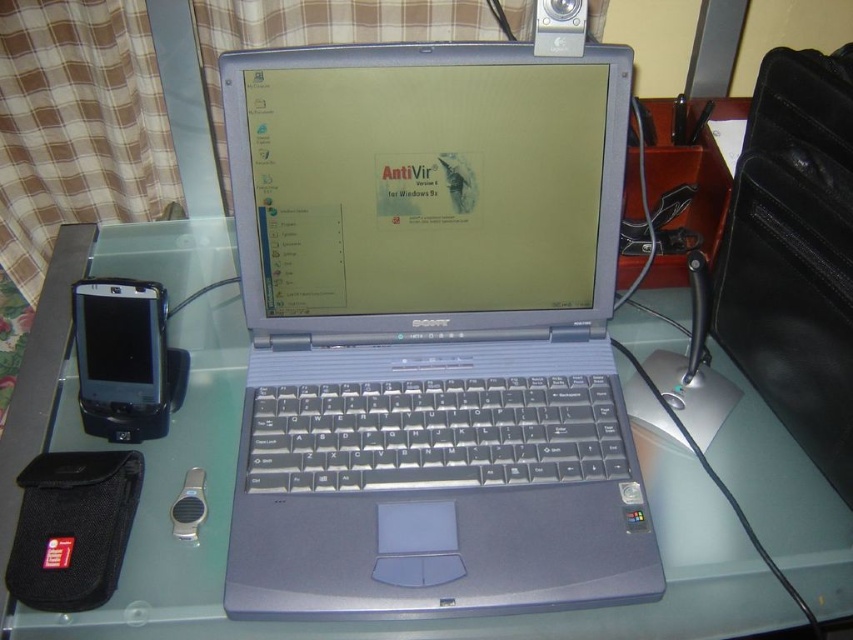
Does silver metallic laptop at center appear on the left side of clear glass table at center?

In fact, silver metallic laptop at center is to the right of clear glass table at center.

Does point (405, 212) lie in front of point (225, 236)?

Yes, point (405, 212) is in front of point (225, 236).

Find the location of `silver metallic laptop at center`. silver metallic laptop at center is located at coordinates (430, 332).